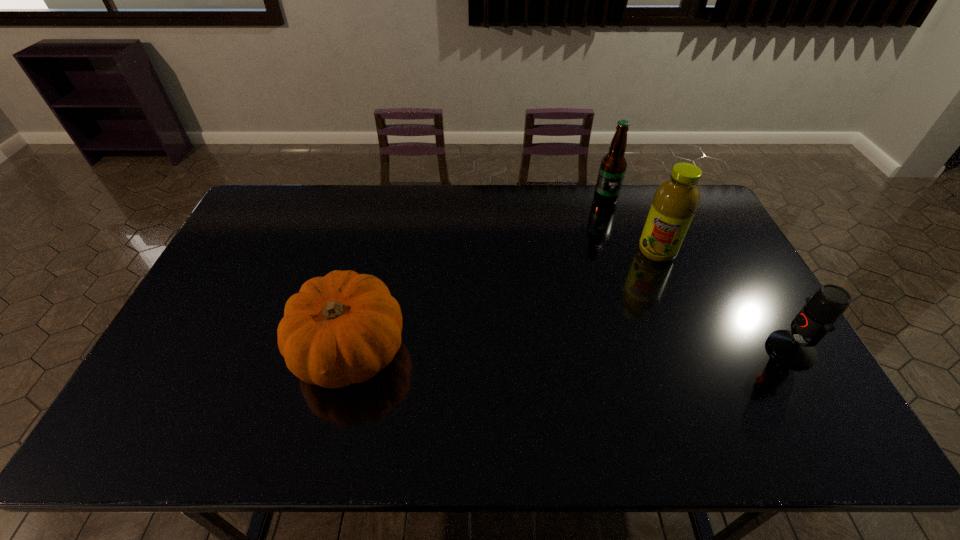
The image size is (960, 540). Identify the location of vacant space that satisfies the following two spatial constraints: 1. on the front side of the leftmost object; 2. on the side of the rightmost object with the red ring. (350, 350).